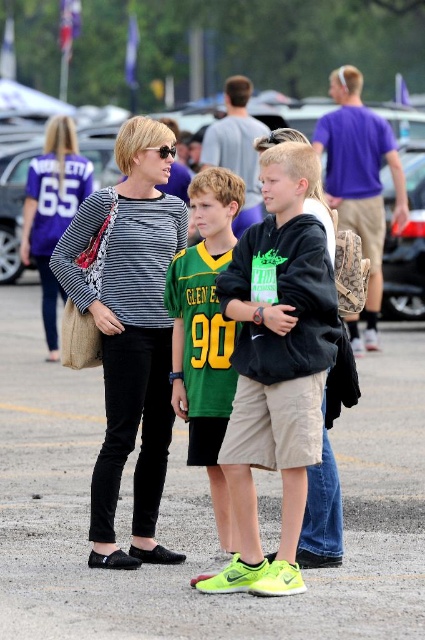
Describe the element at coordinates (206, 333) in the screenshot. The height and width of the screenshot is (640, 425). I see `green jersey at center` at that location.

Which of these two, green jersey at center or matte black striped shirt at center, stands taller?

Standing taller between the two is green jersey at center.

Is point (184, 292) positioned after point (79, 164)?

No, (184, 292) is closer to viewer.

Where is `green jersey at center`? green jersey at center is located at coordinates (206, 333).

Is neon green athletic shoe at center positioned in front of matte black backpack at center?

Yes, neon green athletic shoe at center is closer to the viewer.

Can you confirm if neon green athletic shoe at center is thinner than matte black backpack at center?

Indeed, neon green athletic shoe at center has a lesser width compared to matte black backpack at center.

Describe the element at coordinates (277, 365) in the screenshot. I see `neon green athletic shoe at center` at that location.

Where is `neon green athletic shoe at center`? The width and height of the screenshot is (425, 640). neon green athletic shoe at center is located at coordinates (277, 365).

Between point (260, 556) and point (31, 214), which one is positioned behind?

The point (31, 214) is behind.

Which is above, neon green athletic shoe at center or matte black striped shirt at center?

matte black striped shirt at center

Is point (280, 212) positioned after point (51, 312)?

No, (280, 212) is in front of (51, 312).

Identify the location of neon green athletic shoe at center. This screenshot has width=425, height=640. [277, 365].